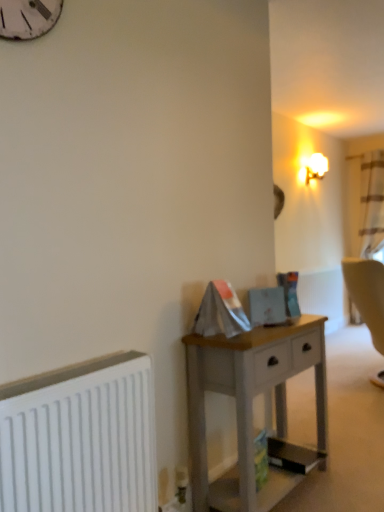
This screenshot has height=512, width=384. What do you see at coordinates (80, 438) in the screenshot?
I see `white matte radiator at lower left` at bounding box center [80, 438].

Locate an element on the screen. Image resolution: width=384 pixels, height=512 pixels. white matte radiator at lower left is located at coordinates (80, 438).

Consider the image. Can we say white painted wood desk at center lies outside white frosted glass lampshade at upper right?

That's correct, white painted wood desk at center is outside of white frosted glass lampshade at upper right.

Is white painted wood desk at center aimed at white frosted glass lampshade at upper right?

No, white painted wood desk at center is not facing towards white frosted glass lampshade at upper right.

From the image's perspective, which is above, white painted wood desk at center or white frosted glass lampshade at upper right?

From the image's view, white frosted glass lampshade at upper right is above.

Is white painted wood desk at center not near white frosted glass lampshade at upper right?

white painted wood desk at center is far away from white frosted glass lampshade at upper right.

Which of these two, white matte radiator at lower left or white frosted glass lampshade at upper right, is bigger?

white matte radiator at lower left is bigger.

Is white matte radiator at lower left next to white frosted glass lampshade at upper right and touching it?

They are not placed beside each other.

Considering the points (57, 454) and (321, 160), which point is in front, point (57, 454) or point (321, 160)?

The point (57, 454) is closer to the camera.

How distant is white matte radiator at lower left from white frosted glass lampshade at upper right?

They are 4.04 meters apart.

Which of these two, white painted wood desk at center or white matte radiator at lower left, is smaller?

white matte radiator at lower left is smaller.

Is white painted wood desk at center completely or partially outside of white matte radiator at lower left?

Yes.

In the image, there is a white matte radiator at lower left. Where is `desk below it (from a real-world perspective)`? desk below it (from a real-world perspective) is located at coordinates (251, 409).

Which of these two, white painted wood desk at center or white matte radiator at lower left, is wider?

With larger width is white painted wood desk at center.

From the image's perspective, is white matte radiator at lower left located beneath white painted wood desk at center?

No, from the image's perspective, white matte radiator at lower left is not below white painted wood desk at center.

Does white matte radiator at lower left appear on the left side of white painted wood desk at center?

Correct, you'll find white matte radiator at lower left to the left of white painted wood desk at center.

Is white matte radiator at lower left looking in the opposite direction of white painted wood desk at center?

That's not correct — white matte radiator at lower left is not looking away from white painted wood desk at center.

Consider the image. From a real-world perspective, relative to white painted wood desk at center, is white matte radiator at lower left vertically above or below?

white matte radiator at lower left is situated higher than white painted wood desk at center in the real world.

Is white frosted glass lampshade at upper right not near white matte radiator at lower left?

Yes, white frosted glass lampshade at upper right is far from white matte radiator at lower left.

Find the location of a particular element. The width and height of the screenshot is (384, 512). radiator that is below the white frosted glass lampshade at upper right (from the image's perspective) is located at coordinates (80, 438).

Is white frosted glass lampshade at upper right further to camera compared to white matte radiator at lower left?

Yes, the depth of white frosted glass lampshade at upper right is greater than that of white matte radiator at lower left.

Considering the points (318, 162) and (149, 442), which point is behind, point (318, 162) or point (149, 442)?

The point (318, 162) is farther from the camera.

Is white frosted glass lampshade at upper right far away from white painted wood desk at center?

Yes, white frosted glass lampshade at upper right is far from white painted wood desk at center.

Considering the relative sizes of white frosted glass lampshade at upper right and white painted wood desk at center in the image provided, is white frosted glass lampshade at upper right bigger than white painted wood desk at center?

Incorrect, white frosted glass lampshade at upper right is not larger than white painted wood desk at center.

From the picture: Which point is more distant from viewer, (313, 156) or (290, 477)?

Point (313, 156)

Where is `desk directly beneath the white frosted glass lampshade at upper right (from a real-world perspective)`? desk directly beneath the white frosted glass lampshade at upper right (from a real-world perspective) is located at coordinates (251, 409).

Identify the location of lamp behind the white matte radiator at lower left. Image resolution: width=384 pixels, height=512 pixels. (316, 167).

Based on their spatial positions, is white matte radiator at lower left or white frosted glass lampshade at upper right closer to white painted wood desk at center?

white matte radiator at lower left.

Which object lies further to the anchor point white matte radiator at lower left, white painted wood desk at center or white frosted glass lampshade at upper right?

white frosted glass lampshade at upper right is positioned further to the anchor white matte radiator at lower left.

Based on their spatial positions, is white frosted glass lampshade at upper right or white painted wood desk at center closer to white matte radiator at lower left?

white painted wood desk at center lies closer to white matte radiator at lower left than the other object.

Estimate the real-world distances between objects in this image. Which object is closer to white painted wood desk at center, white frosted glass lampshade at upper right or white matte radiator at lower left?

Based on the image, white matte radiator at lower left appears to be nearer to white painted wood desk at center.

Which object lies further to the anchor point white frosted glass lampshade at upper right, white painted wood desk at center or white matte radiator at lower left?

The object further to white frosted glass lampshade at upper right is white matte radiator at lower left.

Considering their positions, is white matte radiator at lower left positioned further to white frosted glass lampshade at upper right than white painted wood desk at center?

The object further to white frosted glass lampshade at upper right is white matte radiator at lower left.

You are a GUI agent. You are given a task and a screenshot of the screen. Output one action in this format:
    pyautogui.click(x=<x>, y=<y>)
    Task: Click on the desk between white matte radiator at lower left and white frosted glass lampshade at upper right in the front-back direction
    This screenshot has height=512, width=384.
    Given the screenshot: What is the action you would take?
    (x=251, y=409)